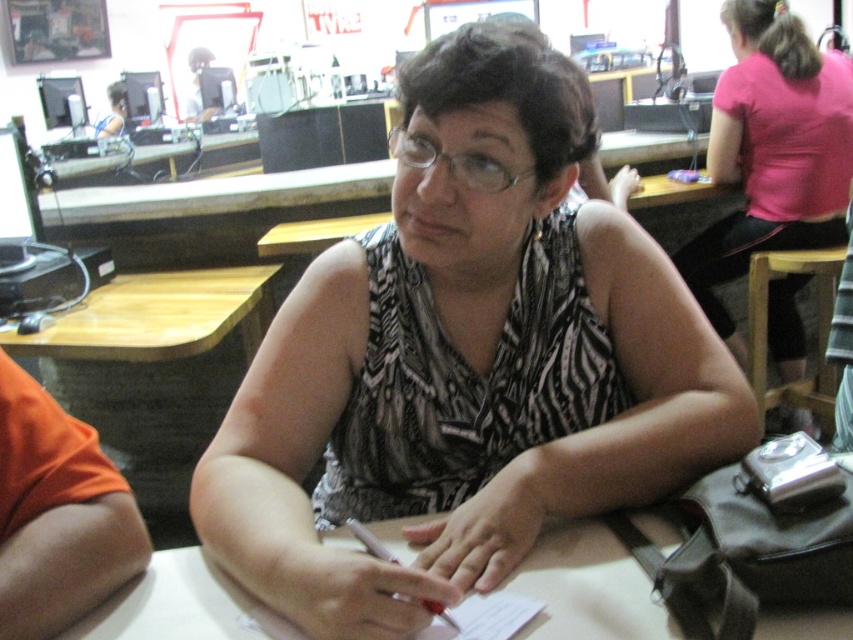
You are a customer in a cafe and want to place your coffee cup on the white matte table at center. However, there is already a matte black laptop at upper left on it. Is there enough space for your coffee cup?

The white matte table at center has a smaller size compared to matte black laptop at upper left, so there may not be enough space for your coffee cup.